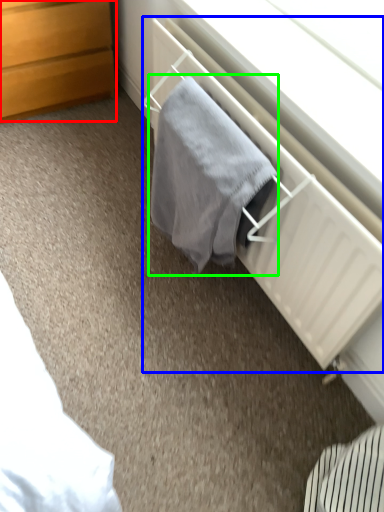
Question: Which is farther away from chest of drawers (highlighted by a red box)? radiator (highlighted by a blue box) or bath towel (highlighted by a green box)?

Choices:
 (A) radiator
 (B) bath towel

Answer: (B)